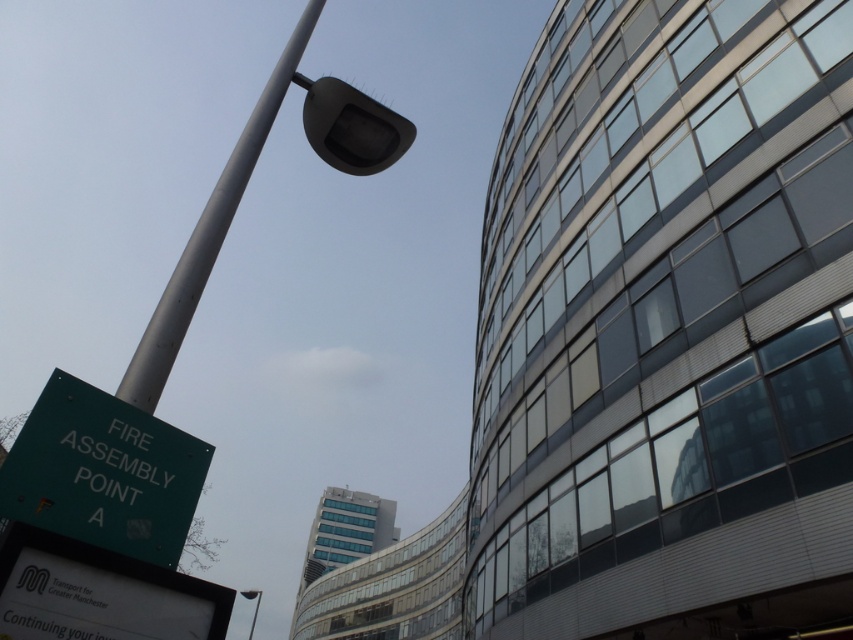
Question: Does green matte sign at lower left appear over silver metallic pole at upper left?

Choices:
 (A) no
 (B) yes

Answer: (A)

Question: Which point is closer to the camera taking this photo?

Choices:
 (A) (3, 500)
 (B) (135, 360)

Answer: (A)

Question: Which object is farther from the camera taking this photo?

Choices:
 (A) metallic gray street light at upper left
 (B) green matte sign at lower left
 (C) silver metallic pole at upper left

Answer: (A)

Question: Among these objects, which one is nearest to the camera?

Choices:
 (A) metallic gray street light at upper left
 (B) silver metallic pole at upper left

Answer: (B)

Question: Does silver metallic pole at upper left have a smaller size compared to metallic gray street light at upper left?

Choices:
 (A) no
 (B) yes

Answer: (B)

Question: Does green matte sign at lower left appear under metallic gray street light at upper left?

Choices:
 (A) yes
 (B) no

Answer: (B)